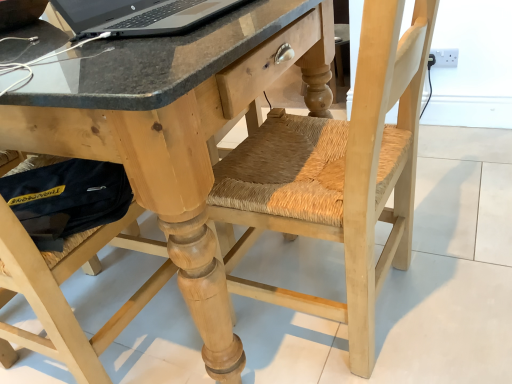
Question: Is natural wood desk at center oriented away from silver metallic laptop at upper left?

Choices:
 (A) yes
 (B) no

Answer: (B)

Question: Would you consider natural wood desk at center to be distant from silver metallic laptop at upper left?

Choices:
 (A) no
 (B) yes

Answer: (A)

Question: Can you confirm if natural wood desk at center is bigger than silver metallic laptop at upper left?

Choices:
 (A) no
 (B) yes

Answer: (B)

Question: Does natural wood desk at center have a lesser width compared to silver metallic laptop at upper left?

Choices:
 (A) no
 (B) yes

Answer: (A)

Question: Is natural wood desk at center outside of silver metallic laptop at upper left?

Choices:
 (A) yes
 (B) no

Answer: (A)

Question: Can you confirm if natural wood desk at center is smaller than silver metallic laptop at upper left?

Choices:
 (A) no
 (B) yes

Answer: (A)

Question: Is natural wood swivel chair at center surrounded by natural wood desk at center?

Choices:
 (A) no
 (B) yes

Answer: (B)

Question: Can we say natural wood desk at center lies outside natural wood swivel chair at center?

Choices:
 (A) yes
 (B) no

Answer: (A)

Question: Is natural wood desk at center directly adjacent to natural wood swivel chair at center?

Choices:
 (A) no
 (B) yes

Answer: (A)

Question: Is natural wood desk at center taller than natural wood swivel chair at center?

Choices:
 (A) no
 (B) yes

Answer: (A)

Question: Does natural wood desk at center have a greater width compared to natural wood swivel chair at center?

Choices:
 (A) yes
 (B) no

Answer: (A)

Question: Considering the relative sizes of natural wood desk at center and natural wood swivel chair at center in the image provided, is natural wood desk at center thinner than natural wood swivel chair at center?

Choices:
 (A) yes
 (B) no

Answer: (B)

Question: Could natural wood desk at center be considered to be inside natural wood swivel chair at center?

Choices:
 (A) yes
 (B) no

Answer: (B)